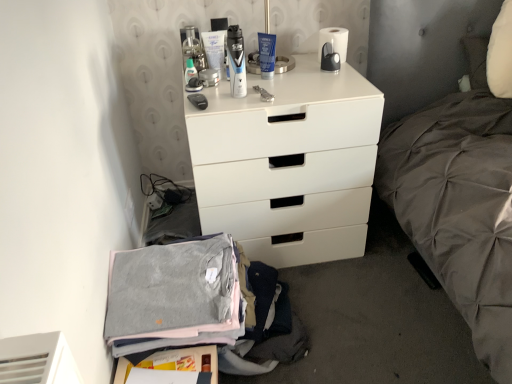
The width and height of the screenshot is (512, 384). What are the coordinates of `vacant space to the right of translucent plastic bottle at upper center` in the screenshot? It's located at pyautogui.click(x=239, y=83).